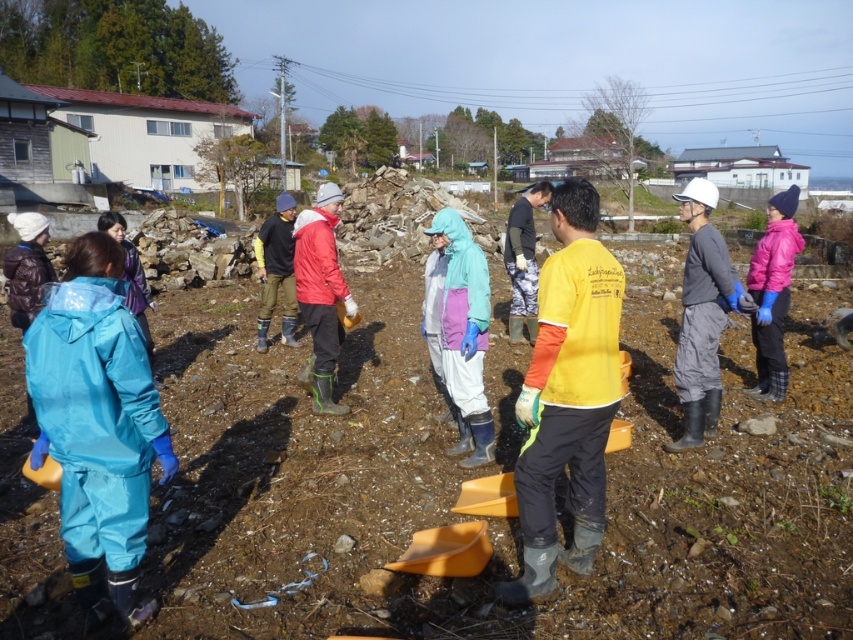
You are part of the cleanup crew and need to place a new bag of tools on the ground. Where should you put it so it stays near the light blue waterproof jacket at center but not on the brown soil at center?

Place the new bag of tools on the left side of the light blue waterproof jacket at center since the brown soil at center is on its right side.

You are a photographer trying to capture a wide shot of the cleanup activity. The camera you are using has a maximum width of 1 meter. Can the brown soil at center and the light blue waterproof jacket at center both fit within the camera frame at the same time?

The brown soil at center is wider than the light blue waterproof jacket at center. Since the camera frame can only accommodate up to 1 meter in width, and the combined width of both objects may exceed this limit, it depends on their exact dimensions. However, the description only states that the soil is wider than the jacket, but not by how much. Without specific measurements, it is uncertain if they can both fit within the 1 meter width.